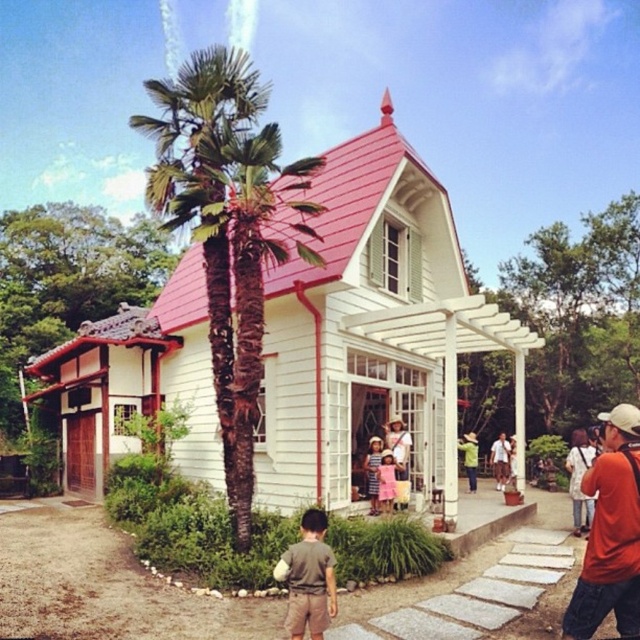
Question: Observing the image, what is the correct spatial positioning of white wood house at center in reference to pink cotton dress at center?

Choices:
 (A) above
 (B) below

Answer: (A)

Question: Which object is positioned farthest from the orange fabric camera at lower right?

Choices:
 (A) brown leather jacket at center
 (B) white wood house at center

Answer: (A)

Question: Among these objects, which one is nearest to the camera?

Choices:
 (A) brown leather jacket at center
 (B) white wood house at center

Answer: (B)

Question: Is brown cotton shirt at lower center bigger than pink cotton dress at center?

Choices:
 (A) yes
 (B) no

Answer: (A)

Question: Among these points, which one is farthest from the camera?

Choices:
 (A) (380, 445)
 (B) (211, 156)
 (C) (40, 358)
 (D) (628, 608)

Answer: (C)

Question: Does white wood house at center have a larger size compared to pink cotton dress at center?

Choices:
 (A) yes
 (B) no

Answer: (A)